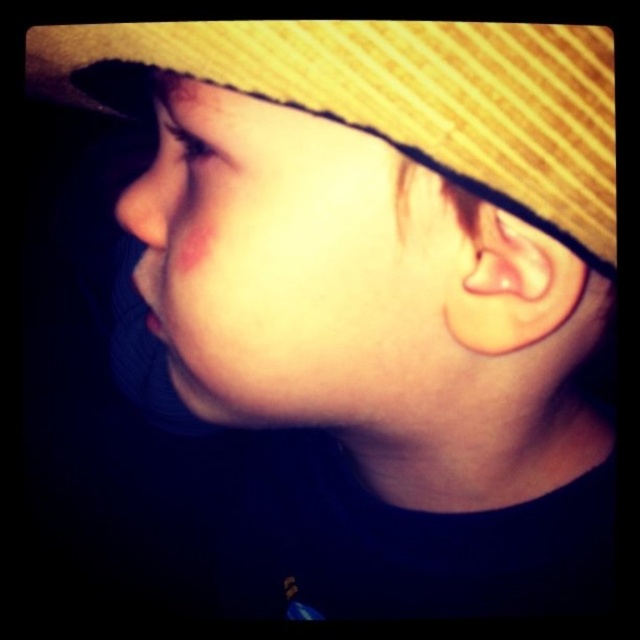
Is pink skin at center positioned in front of yellow woven hat at upper center?

No.

Measure the distance from pink skin at center to yellow woven hat at upper center.

They are 2.65 inches apart.

Between point (289, 113) and point (323, 45), which one is positioned behind?

The point (289, 113) is behind.

The width and height of the screenshot is (640, 640). Find the location of `pink skin at center`. pink skin at center is located at coordinates (292, 266).

Between point (385, 132) and point (164, 228), which one is positioned in front?

Point (385, 132) is more forward.

Who is more distant from viewer, (500, 74) or (164, 184)?

The point (164, 184) is more distant.

Is point (161, 35) in front of point (124, 196)?

Yes, it is in front of point (124, 196).

Identify the location of yellow woven hat at upper center. The width and height of the screenshot is (640, 640). (392, 97).

Between pink skin at center and matte skin nose at left, which one is positioned higher?

Positioned higher is matte skin nose at left.

The width and height of the screenshot is (640, 640). What do you see at coordinates (292, 266) in the screenshot?
I see `pink skin at center` at bounding box center [292, 266].

Which is behind, point (317, 253) or point (156, 150)?

The point (156, 150) is more distant.

In order to click on pink skin at center in this screenshot , I will do `click(292, 266)`.